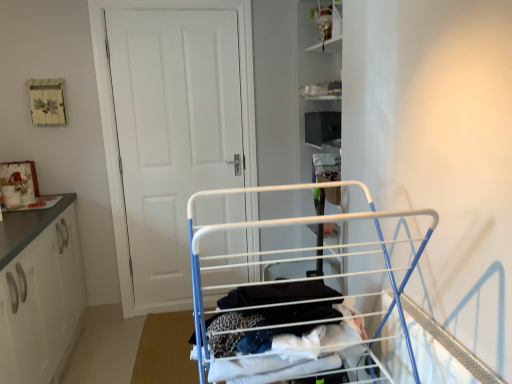
Find the location of `free spot above white matte door at center (from a real-world perspective)`. free spot above white matte door at center (from a real-world perspective) is located at coordinates (173, 4).